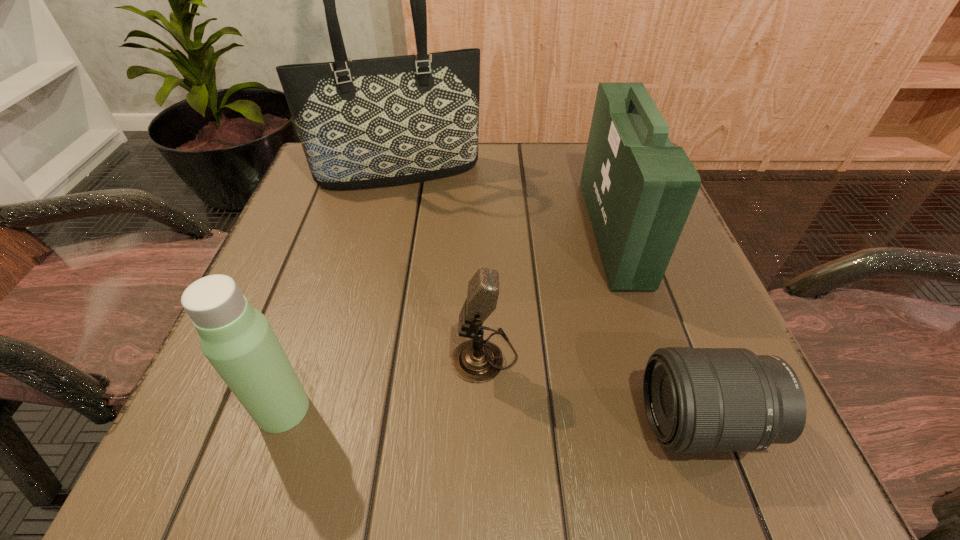
Where is `the tallest object`? the tallest object is located at coordinates (375, 122).

Locate an element on the screen. the first-aid kit is located at coordinates (639, 189).

At what (x,y) coordinates should I click in order to perform the action: click on thermos bottle. Please return your answer as a coordinate pair (x, y). The width and height of the screenshot is (960, 540). Looking at the image, I should click on (237, 339).

At what (x,y) coordinates should I click in order to perform the action: click on microphone. Please return your answer as a coordinate pair (x, y). Looking at the image, I should click on (476, 360).

Identify the location of the shortest object. (697, 400).

The height and width of the screenshot is (540, 960). What are the coordinates of `vacant area situated 0.240m on the front of the tallest object` in the screenshot? It's located at (375, 274).

Where is `free spot located 0.060m on the front-facing side of the first-aid kit`? This screenshot has width=960, height=540. free spot located 0.060m on the front-facing side of the first-aid kit is located at coordinates (563, 231).

Where is `vacant space located 0.400m on the front-facing side of the first-aid kit`? vacant space located 0.400m on the front-facing side of the first-aid kit is located at coordinates (386, 231).

Locate an element on the screen. The width and height of the screenshot is (960, 540). free region located on the front-facing side of the first-aid kit is located at coordinates (490, 231).

Where is `free space located 0.050m on the left of the thermos bottle`? This screenshot has width=960, height=540. free space located 0.050m on the left of the thermos bottle is located at coordinates (220, 409).